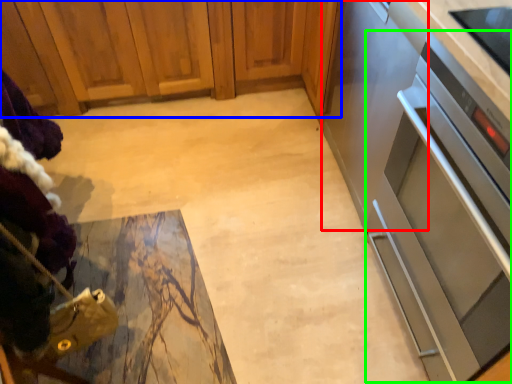
Question: Based on their relative distances, which object is nearer to appliance (highlighted by a red box)? Choose from cabinetry (highlighted by a blue box) and oven (highlighted by a green box).

Choices:
 (A) cabinetry
 (B) oven

Answer: (B)